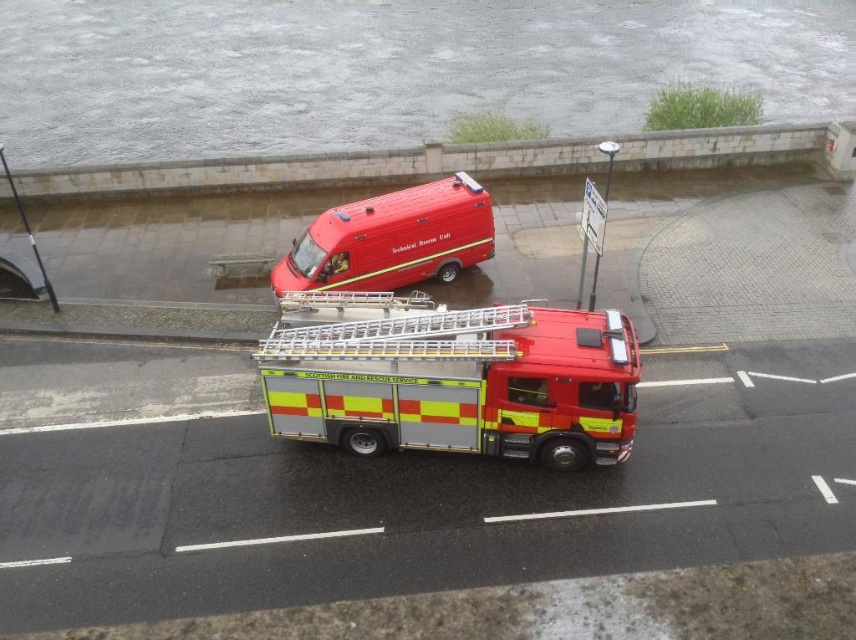
You are a firefighter assessing the scene. You need to determine if the Scottish Fire and Rescue Service fire truck can safely move forward from its current position to reach the Technical Rescue Unit van parked parallel to it. Based on the presence of the gray concrete flood at upper center located at point [388,68], would this obstacle block the fire truck from moving forward?

The gray concrete flood at upper center is located at point [388,68], which is in the upper center of the scene. Since the fire truck is in the foreground and the Technical Rescue Unit van is parked parallel in the background, the flood at upper center would likely block the fire truck from moving forward towards the van.

You are a delivery driver who needs to cross the gray concrete flood at upper center to reach the metallic red fire truck at center. Can your truck, which is 2 meters wide, safely pass through the flood without getting stuck?

The gray concrete flood at upper center has a width larger than the metallic red fire truck at center. Since your truck is 2 meters wide, it should be able to safely pass through the flood as long as the flood is not too deep or fast flowing. However, the exact depth and flow rate of the flood are not provided, so proceed with caution.

You are standing at the origin point in the image. There are two points marked in the scene. Which point, point (x=723, y=45) or point (x=854, y=124), is closer to you?

Point (x=854, y=124) is closer to you because it is in front of point (x=723, y=45).